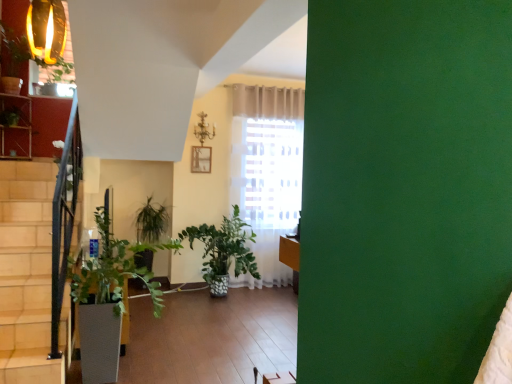
Question: From the image's perspective, relative to white textured flowerpot at lower left, is green glossy plant at lower center above or below?

Choices:
 (A) below
 (B) above

Answer: (B)

Question: From their relative heights in the image, would you say green glossy plant at lower center is taller or shorter than white textured flowerpot at lower left?

Choices:
 (A) short
 (B) tall

Answer: (B)

Question: Looking at their shapes, would you say green glossy plant at lower center is wider or thinner than white textured flowerpot at lower left?

Choices:
 (A) thin
 (B) wide

Answer: (B)

Question: In the image, is white textured flowerpot at lower left on the left side or the right side of green glossy plant at lower center?

Choices:
 (A) right
 (B) left

Answer: (B)

Question: Considering the positions of white textured flowerpot at lower left and green glossy plant at lower center in the image, is white textured flowerpot at lower left wider or thinner than green glossy plant at lower center?

Choices:
 (A) thin
 (B) wide

Answer: (A)

Question: Is white textured flowerpot at lower left bigger or smaller than green glossy plant at lower center?

Choices:
 (A) big
 (B) small

Answer: (B)

Question: Is white textured flowerpot at lower left situated inside green glossy plant at lower center or outside?

Choices:
 (A) inside
 (B) outside

Answer: (A)